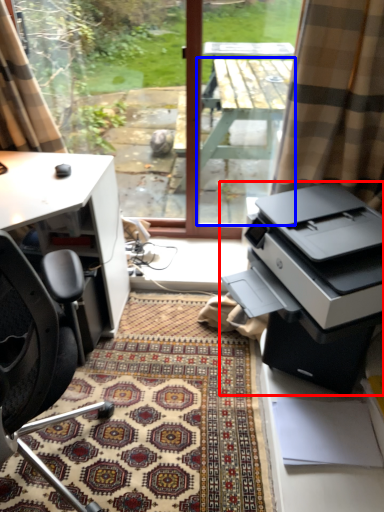
Question: Which object appears farthest to the camera in this image, printer (highlighted by a red box) or table (highlighted by a blue box)?

Choices:
 (A) printer
 (B) table

Answer: (B)